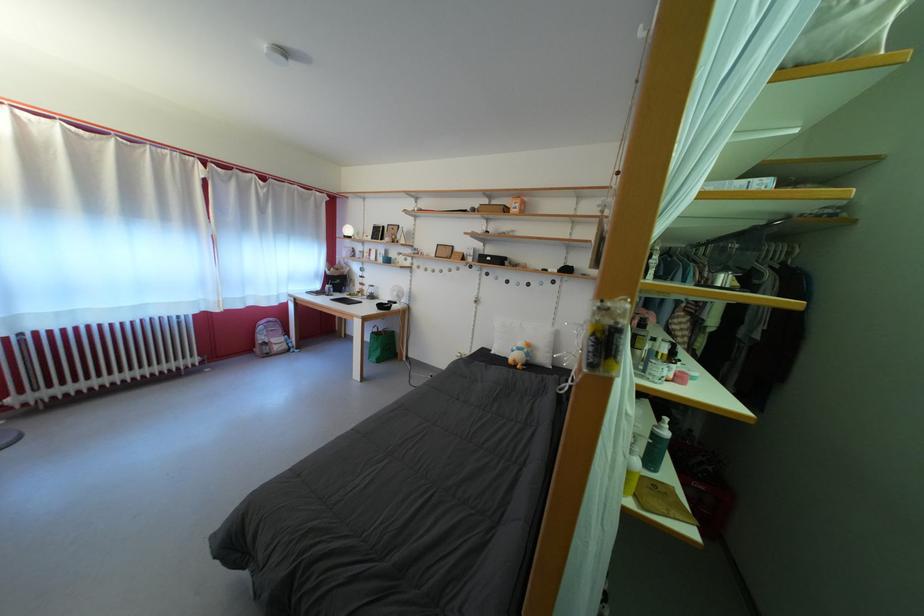
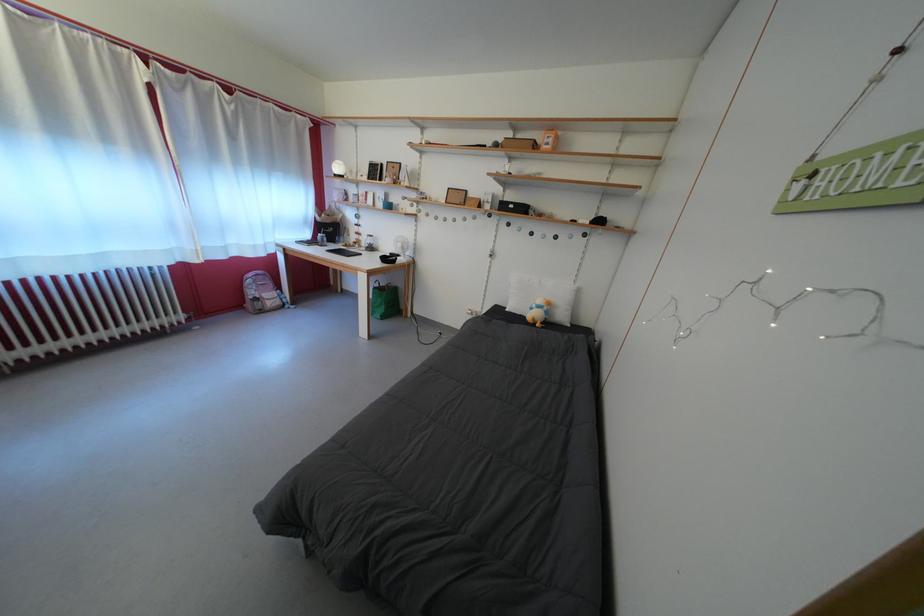
Locate, in the second image, the point that corresponds to the point at 496,265 in the first image.

(519, 213)